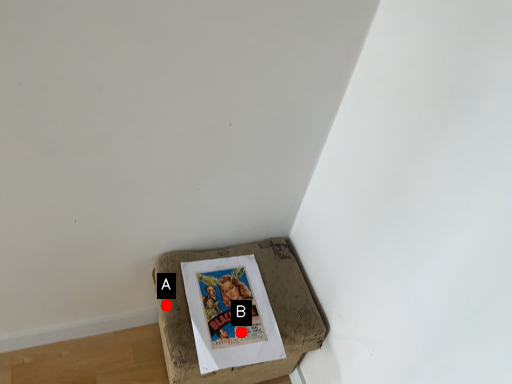
Question: Two points are circled on the image, labeled by A and B beside each circle. Which point appears farthest from the camera in this image?

Choices:
 (A) A is further
 (B) B is further

Answer: (A)